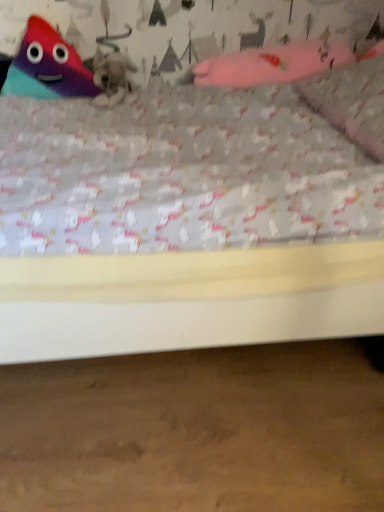
Question: Choose the correct answer: Is pink fabric pillow at upper right inside matte plastic triangle at upper left, which appears as the 2th toy when viewed from the right, or outside it?

Choices:
 (A) inside
 (B) outside

Answer: (B)

Question: Is pink fabric pillow at upper right in front of or behind matte plastic triangle at upper left, the 1th toy viewed from the left, in the image?

Choices:
 (A) front
 (B) behind

Answer: (A)

Question: Which object is positioned closest to the pink fabric pillow at upper right?

Choices:
 (A) pink fabric glove at upper right, which ranks as the 1th toy in right-to-left order
 (B) fuzzy gray cat at upper center
 (C) matte plastic triangle at upper left, which appears as the 2th toy when viewed from the right

Answer: (A)

Question: Which of these objects is positioned farthest from the fuzzy gray cat at upper center?

Choices:
 (A) pink fabric glove at upper right, the second toy from the left
 (B) pink fabric pillow at upper right
 (C) matte plastic triangle at upper left, the 1th toy viewed from the left

Answer: (B)